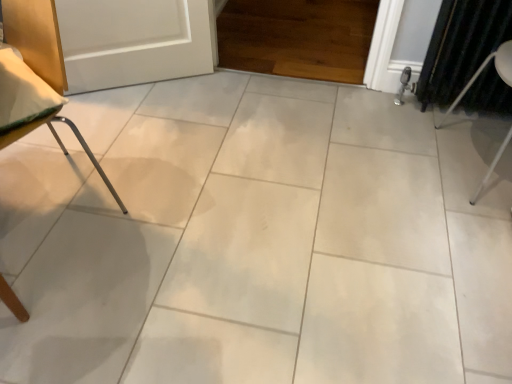
The width and height of the screenshot is (512, 384). In order to click on free space between metallic silver chair leg at left, positioned as the second furniture in right-to-left order, and white metal chair at right, the second furniture viewed from the left in this screenshot , I will do `click(282, 180)`.